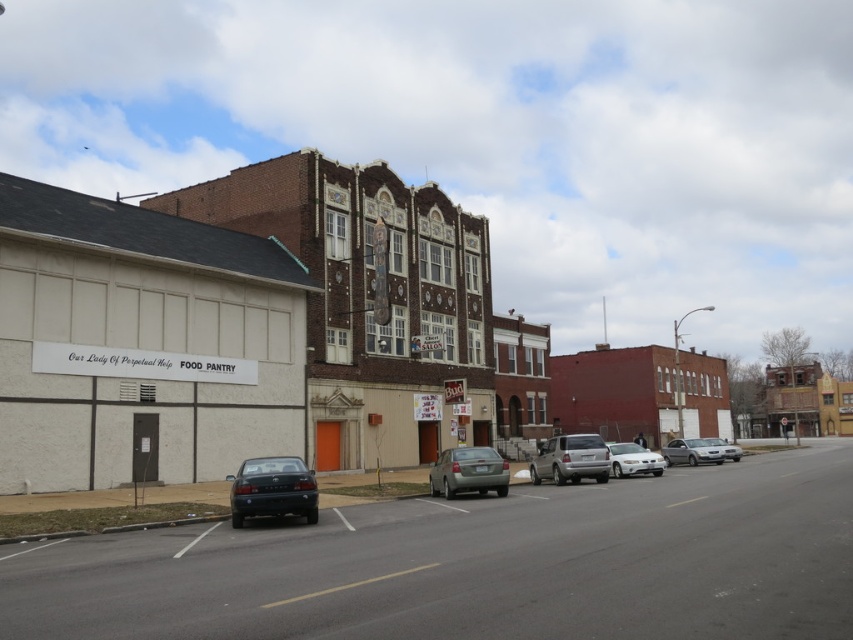
You are a delivery driver who needs to park your 4.5 meter long truck. You see the matte black sedan at lower left and the white glossy sedan at center blocking the road. Can you park your truck between them?

The matte black sedan at lower left is shorter than the white glossy sedan at center. Since the truck is 4.5 meters long, it may not fit between them if the space between the two sedans is less than 4.5 meters. However, the description only mentions their lengths, not the distance between them. Therefore, it is unclear if there is enough space.

You are a delivery driver who needs to park your 1.8 meters tall delivery van. You see the matte black sedan at lower left and the silver metallic suv at center. Which vehicle has enough clearance height for your van to pass under it?

The matte black sedan at lower left has a lesser height compared to silver metallic suv at center, so the silver metallic suv at center has enough clearance height for your van to pass under it.